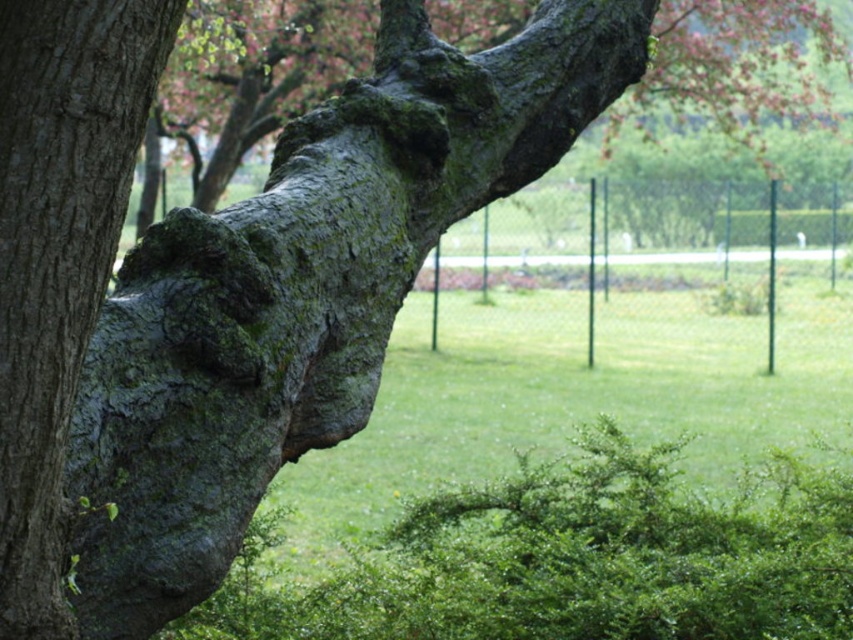
Question: Which object appears farthest from the camera in this image?

Choices:
 (A) smooth bark tree trunk at center
 (B) green mossy bark at center

Answer: (A)

Question: Does green mossy bark at center appear under smooth bark tree trunk at center?

Choices:
 (A) yes
 (B) no

Answer: (A)

Question: Does green mossy bark at center have a greater width compared to smooth bark tree trunk at center?

Choices:
 (A) yes
 (B) no

Answer: (B)

Question: Can you confirm if green mossy bark at center is positioned to the left of smooth bark tree trunk at center?

Choices:
 (A) yes
 (B) no

Answer: (B)

Question: Among these points, which one is farthest from the camera?

Choices:
 (A) (718, 36)
 (B) (3, 340)

Answer: (A)

Question: Which point is closer to the camera taking this photo?

Choices:
 (A) (674, 29)
 (B) (53, 307)

Answer: (B)